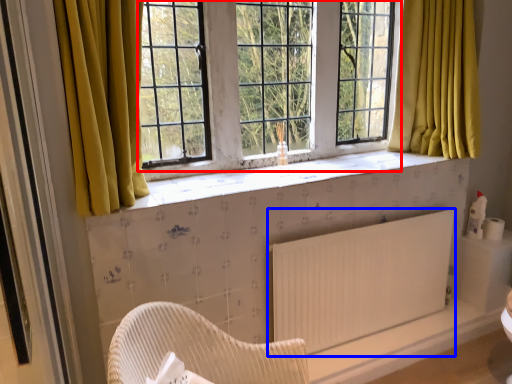
Question: Which point is further to the camera, window screen (highlighted by a red box) or radiator (highlighted by a blue box)?

Choices:
 (A) window screen
 (B) radiator

Answer: (B)